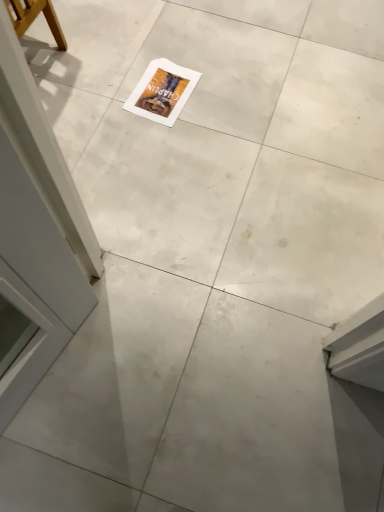
Locate an element on the screen. vacant area located to the right-hand side of white paper postcard at center is located at coordinates (219, 93).